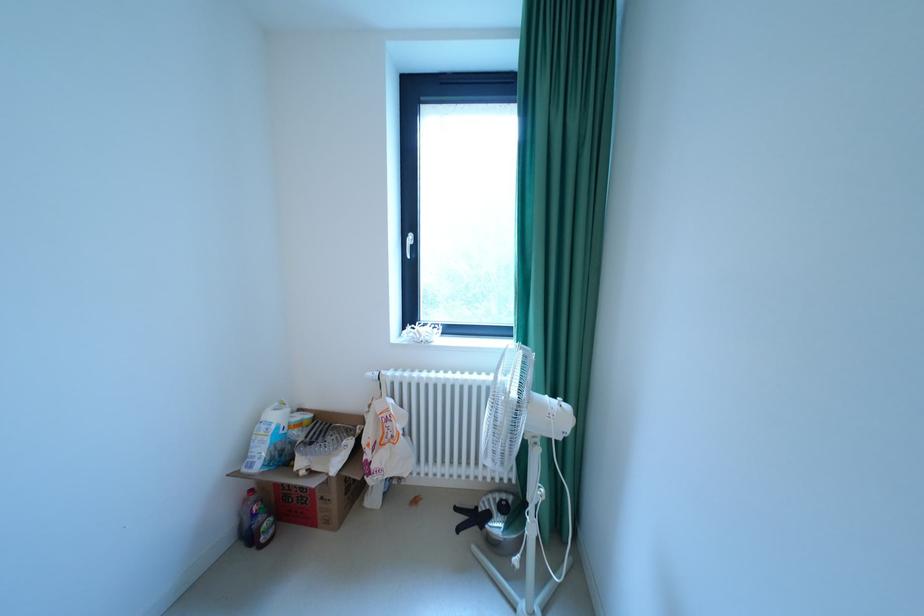
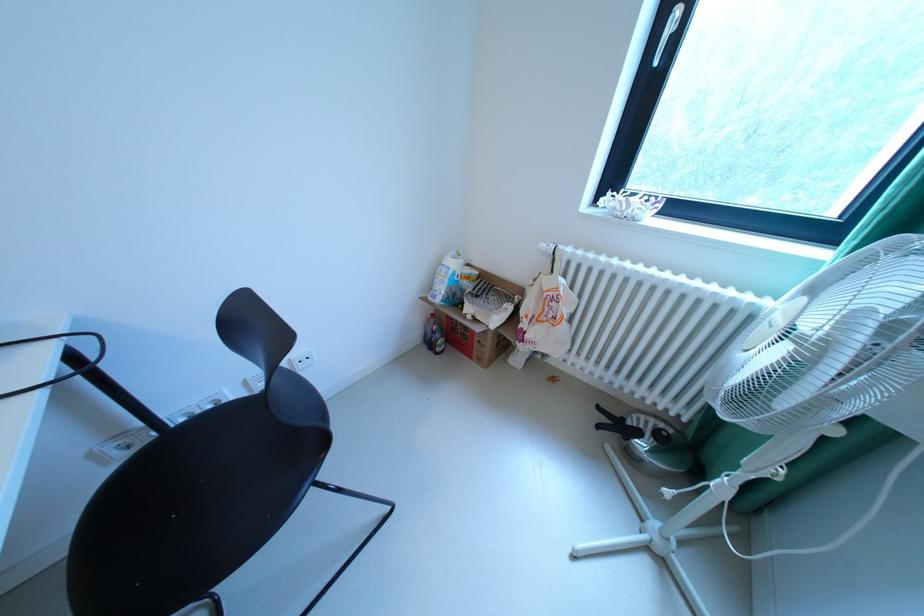
Find the pixel in the second image that matches the point at 271,439 in the first image.

(451, 278)